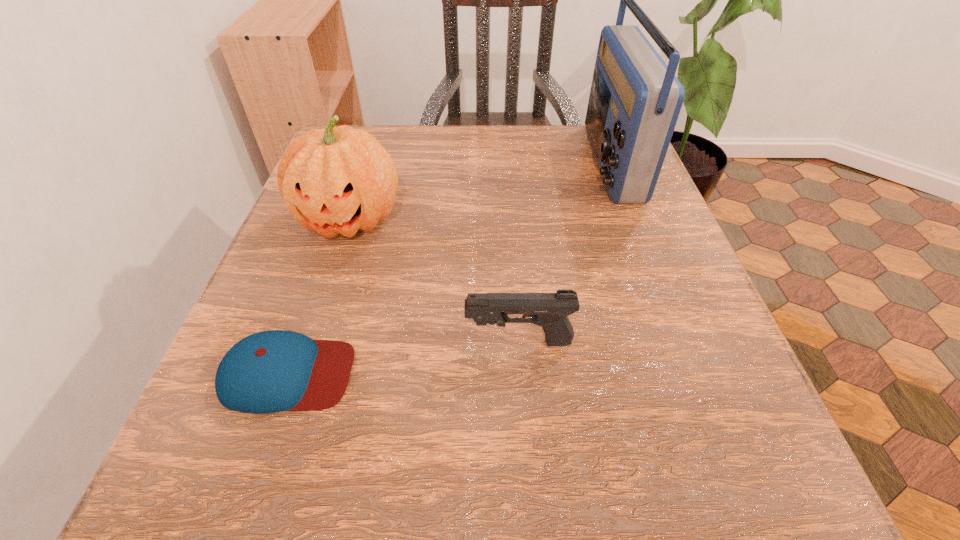
In the image, there is a desktop. Find the location of `vacant space at the near edge`. vacant space at the near edge is located at coordinates [x=384, y=481].

I want to click on vacant space at the left edge of the desktop, so coord(311,246).

The width and height of the screenshot is (960, 540). In the image, there is a desktop. What are the coordinates of `vacant area at the right edge` in the screenshot? It's located at (657, 241).

Where is `vacant region at the far left corner of the desktop`? The image size is (960, 540). vacant region at the far left corner of the desktop is located at coordinates (388, 139).

The width and height of the screenshot is (960, 540). Identify the location of free space between the second object from right to left and the pumpkin. (434, 280).

You are a GUI agent. You are given a task and a screenshot of the screen. Output one action in this format:
    pyautogui.click(x=<x>, y=<y>)
    Task: Click on the free space that is in between the tallest object and the shortest object
    This screenshot has width=960, height=540.
    Given the screenshot: What is the action you would take?
    pyautogui.click(x=448, y=268)

Locate an element on the screen. The height and width of the screenshot is (540, 960). vacant space in between the radio receiver and the pumpkin is located at coordinates (480, 191).

You are a GUI agent. You are given a task and a screenshot of the screen. Output one action in this format:
    pyautogui.click(x=<x>, y=<y>)
    Task: Click on the empty location between the rightmost object and the baseball cap
    The image size is (960, 540).
    Given the screenshot: What is the action you would take?
    pyautogui.click(x=448, y=268)

The height and width of the screenshot is (540, 960). I want to click on empty location between the baseball cap and the third shortest object, so click(x=319, y=296).

Locate an element on the screen. empty space between the pistol and the pumpkin is located at coordinates (434, 280).